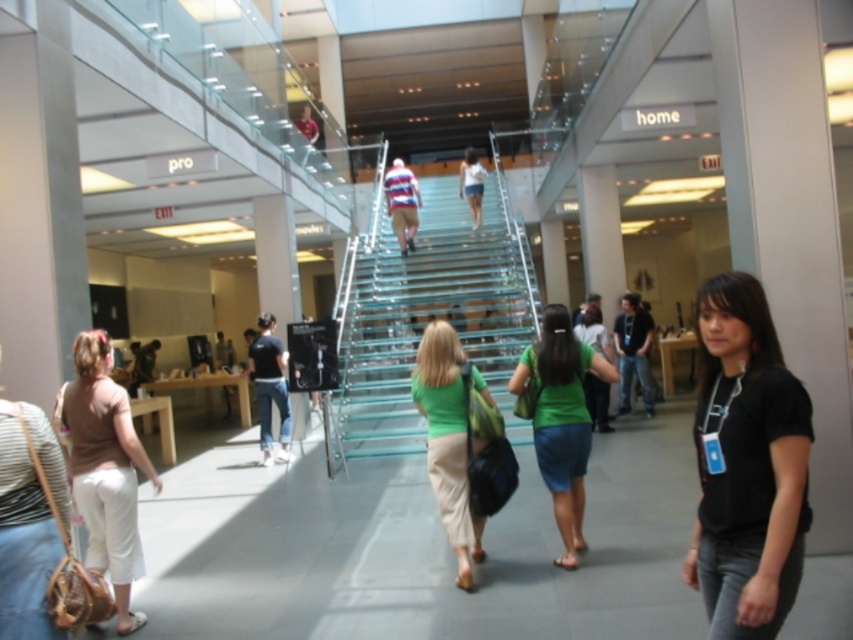
Question: Does transparent glass stairs at center have a greater width compared to black cotton shirt at lower right?

Choices:
 (A) no
 (B) yes

Answer: (A)

Question: Which object is positioned farthest from the striped cotton shirt at center?

Choices:
 (A) green matte shirt at center
 (B) white matte shirt at center

Answer: (A)

Question: Is black cotton shirt at lower right above green fabric shirt at center?

Choices:
 (A) yes
 (B) no

Answer: (A)

Question: Does green fabric shirt at center have a lesser width compared to white matte shirt at center?

Choices:
 (A) yes
 (B) no

Answer: (B)

Question: Which of these objects is positioned closest to the striped fabric purse at lower left?

Choices:
 (A) striped cotton shirt at center
 (B) transparent glass stairs at center
 (C) white matte shirt at center

Answer: (B)

Question: Which object appears farthest from the camera in this image?

Choices:
 (A) black cotton shirt at lower right
 (B) green matte shirt at center

Answer: (B)